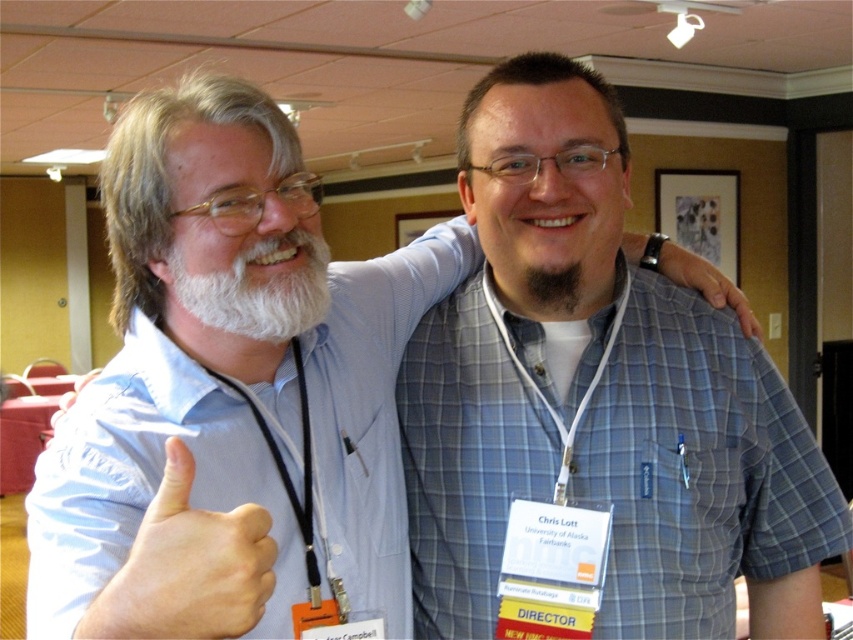
Is point (117, 576) positioned behind point (321, 294)?

No, (117, 576) is in front of (321, 294).

Which is in front, point (245, 528) or point (225, 291)?

Positioned in front is point (245, 528).

Locate an element on the screen. The height and width of the screenshot is (640, 853). skinny white hand at center is located at coordinates (187, 566).

Does blue plaid shirt at center have a lesser width compared to whitewoollybeard at left?

In fact, blue plaid shirt at center might be wider than whitewoollybeard at left.

Locate an element on the screen. The width and height of the screenshot is (853, 640). blue plaid shirt at center is located at coordinates (598, 397).

At what (x,y) coordinates should I click in order to perform the action: click on blue plaid shirt at center. Please return your answer as a coordinate pair (x, y). Image resolution: width=853 pixels, height=640 pixels. Looking at the image, I should click on (598, 397).

Is point (138, 547) positioned in front of point (535, 282)?

Yes.

Between skinny white hand at center and dark brown fuzzy beard at center, which one appears on the left side from the viewer's perspective?

skinny white hand at center

Is point (152, 580) positioned after point (556, 275)?

No, (152, 580) is in front of (556, 275).

The width and height of the screenshot is (853, 640). What are the coordinates of `skinny white hand at center` in the screenshot? It's located at (187, 566).